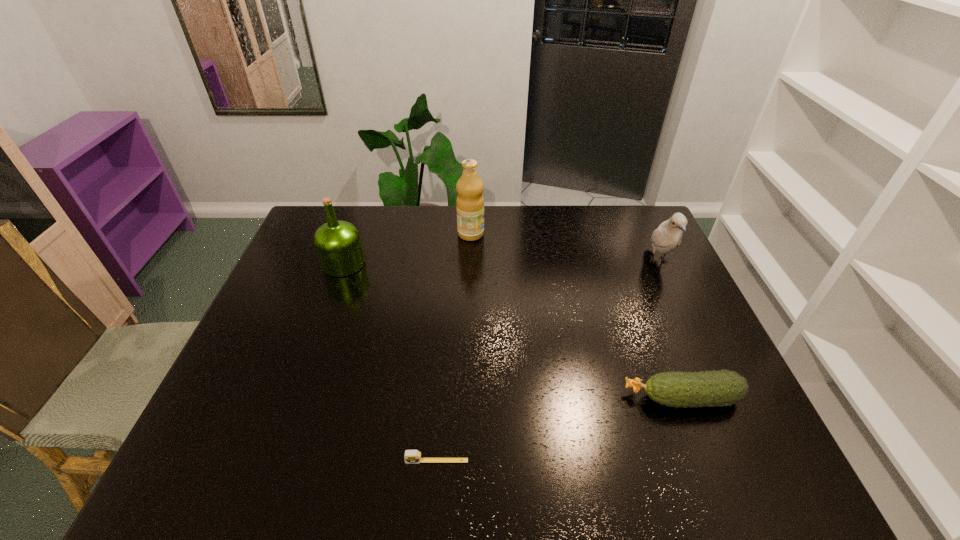
At what (x,y) coordinates should I click in order to perform the action: click on free region located 0.170m on the right of the leftmost object. Please return your answer as a coordinate pair (x, y). The width and height of the screenshot is (960, 540). Looking at the image, I should click on (417, 264).

The height and width of the screenshot is (540, 960). What are the coordinates of `free location located 0.170m at the beak of the bird` in the screenshot? It's located at (686, 322).

I want to click on vacant space located at the blossom end of the cucumber, so click(569, 398).

The width and height of the screenshot is (960, 540). Identify the location of vacant area located 0.330m at the blossom end of the cucumber. pos(487,398).

This screenshot has height=540, width=960. Identify the location of blank space located 0.220m at the blossom end of the cucumber. (532, 398).

Identify the location of olive oil located in the far edge section of the desktop. (470, 202).

Image resolution: width=960 pixels, height=540 pixels. I want to click on bird that is at the far edge, so click(668, 235).

Where is `object positioned at the near edge`? This screenshot has width=960, height=540. object positioned at the near edge is located at coordinates (411, 456).

Locate an element on the screen. object present at the left edge is located at coordinates (338, 245).

The height and width of the screenshot is (540, 960). I want to click on bird that is at the right edge, so click(x=668, y=235).